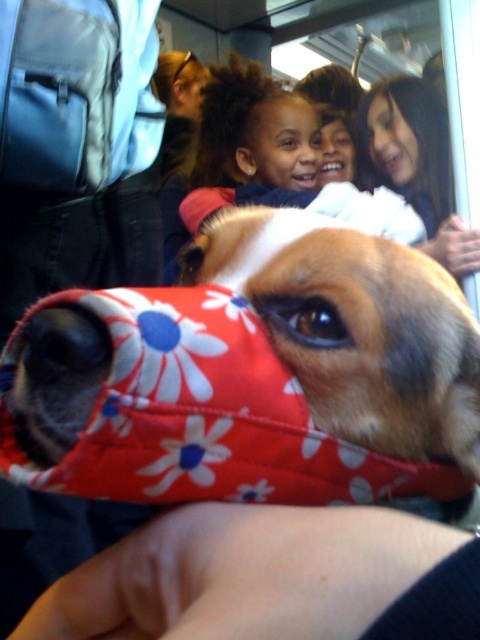
You are a photographer trying to focus on the dog in the image. You notice two features on the dog, the matte brown hair at upper center and the brown fur nose at center. Which of these two features is positioned higher up in the image?

The matte brown hair at upper center is much taller than the brown fur nose at center, so it is positioned higher up in the image.

You are a photographer reviewing the image of a dog with a red bandana. In the background, there are two people with dark brown hair at upper center and matte brown hair at upper center. Which person has their hair higher up in the frame?

The matte brown hair at upper center is taller than dark brown hair at upper center, so the person with matte brown hair at upper center has their hair higher up in the frame.

In the scene shown: Based on the scene description, where is the smooth brown hair at upper center located in the image?

The smooth brown hair at upper center is located at point coordinates of (332, 88).